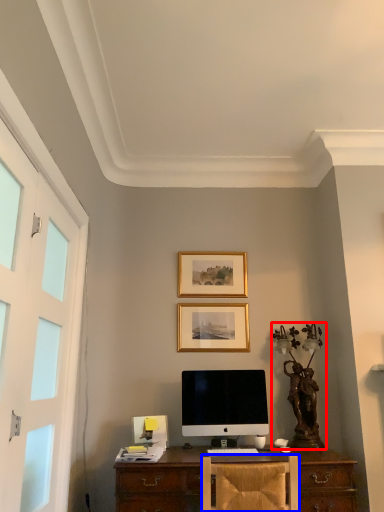
Question: Among these objects, which one is nearest to the camera, antique (highlighted by a red box) or chair (highlighted by a blue box)?

Choices:
 (A) antique
 (B) chair

Answer: (B)